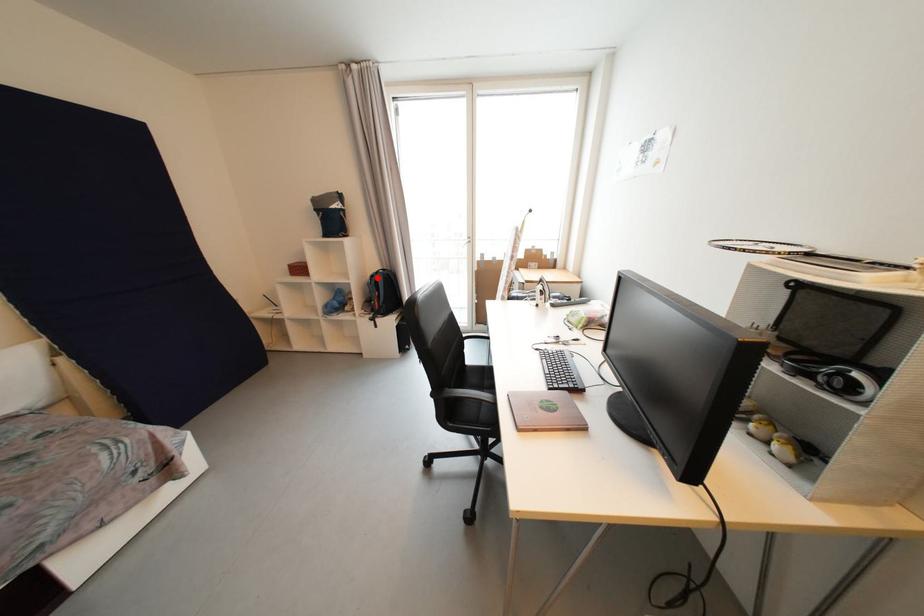
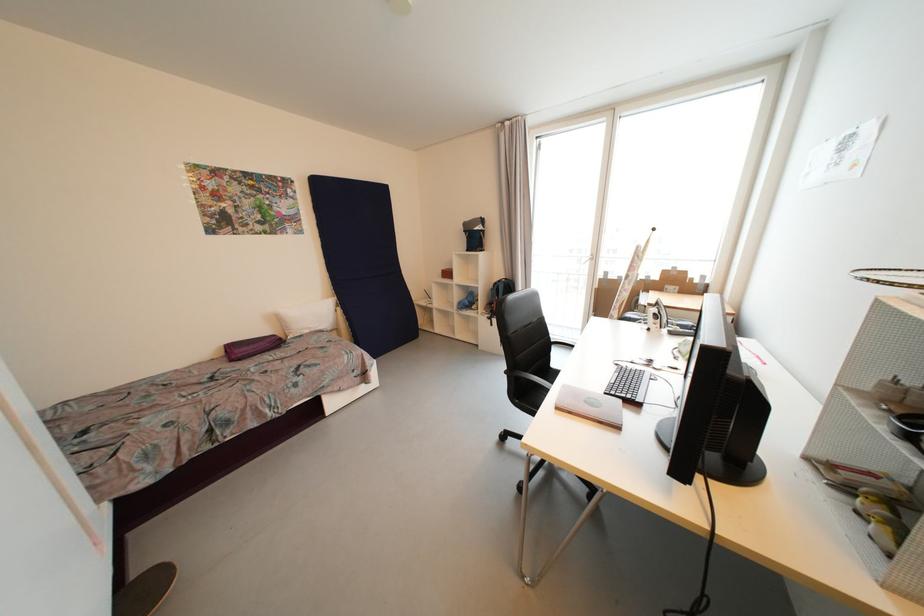
Question: I am providing you with two images of the same scene from different viewpoints. In image1, a red point is highlighted. Considering the same 3D point in image2, which of the following is correct?

Choices:
 (A) It is closer
 (B) It is farther

Answer: (B)